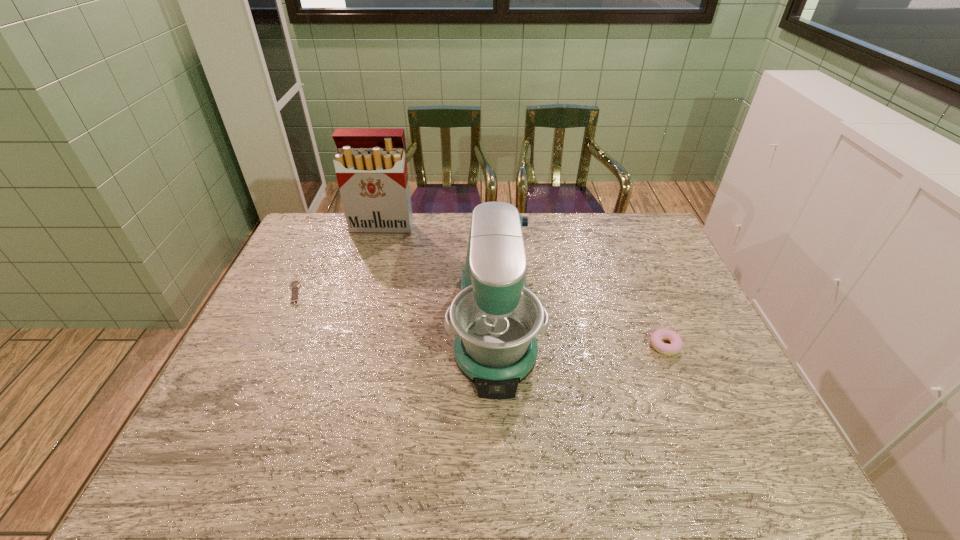
You are a GUI agent. You are given a task and a screenshot of the screen. Output one action in this format:
    pyautogui.click(x=<x>, y=<y>)
    Task: Click on the vacant area that lies between the third object from left to right and the second object from left to right
    The height and width of the screenshot is (540, 960).
    Given the screenshot: What is the action you would take?
    point(439,278)

At what (x,y) coordinates should I click in order to perform the action: click on vacant space in between the second object from left to right and the second tallest object. Please return your answer as a coordinate pair (x, y). Looking at the image, I should click on (439, 278).

Where is `free spot between the doughnut and the second object from right to left`? The width and height of the screenshot is (960, 540). free spot between the doughnut and the second object from right to left is located at coordinates click(x=580, y=338).

Where is `free space between the mixer and the farthest object`? The height and width of the screenshot is (540, 960). free space between the mixer and the farthest object is located at coordinates (439, 278).

Where is `blank region between the second object from left to right and the third object from left to right`? blank region between the second object from left to right and the third object from left to right is located at coordinates (439, 278).

At what (x,y) coordinates should I click in order to perform the action: click on unoccupied position between the mixer and the third object from right to left. Please return your answer as a coordinate pair (x, y). The width and height of the screenshot is (960, 540). Looking at the image, I should click on (439, 278).

The height and width of the screenshot is (540, 960). Find the location of `object that ranks as the third closest to the second object from right to left`. object that ranks as the third closest to the second object from right to left is located at coordinates (294, 285).

The width and height of the screenshot is (960, 540). I want to click on the second closest object to the watch, so click(x=496, y=318).

Find the location of a particular element. The height and width of the screenshot is (540, 960). free space in the image that satisfies the following two spatial constraints: 1. on the front-facing side of the third tallest object; 2. on the right side of the second tallest object is located at coordinates (495, 346).

Identify the location of vacant space that satisfies the following two spatial constraints: 1. with the lid open on the cigarette case; 2. on the left side of the doughnut. The width and height of the screenshot is (960, 540). (348, 346).